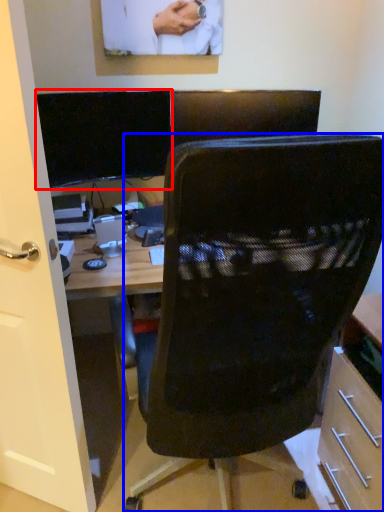
Question: Which object appears closest to the camera in this image, computer monitor (highlighted by a red box) or chair (highlighted by a blue box)?

Choices:
 (A) computer monitor
 (B) chair

Answer: (B)